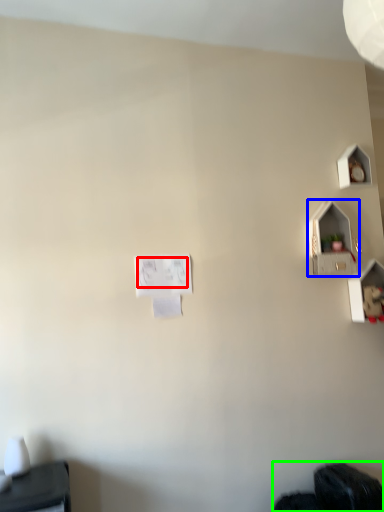
Question: Which object is the farthest from writing (highlighted by a red box)? Choose among these: twin (highlighted by a blue box) or wide (highlighted by a green box).

Choices:
 (A) twin
 (B) wide

Answer: (B)